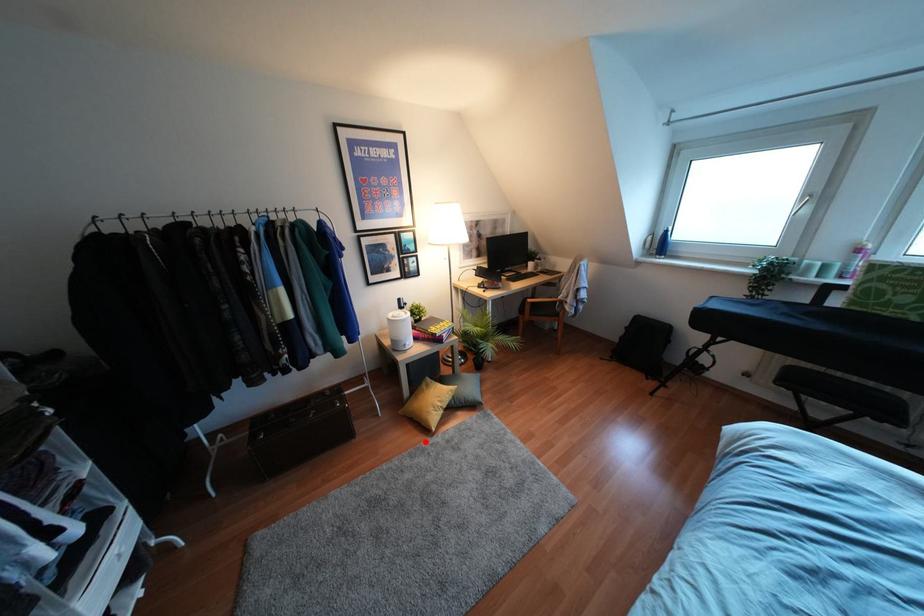
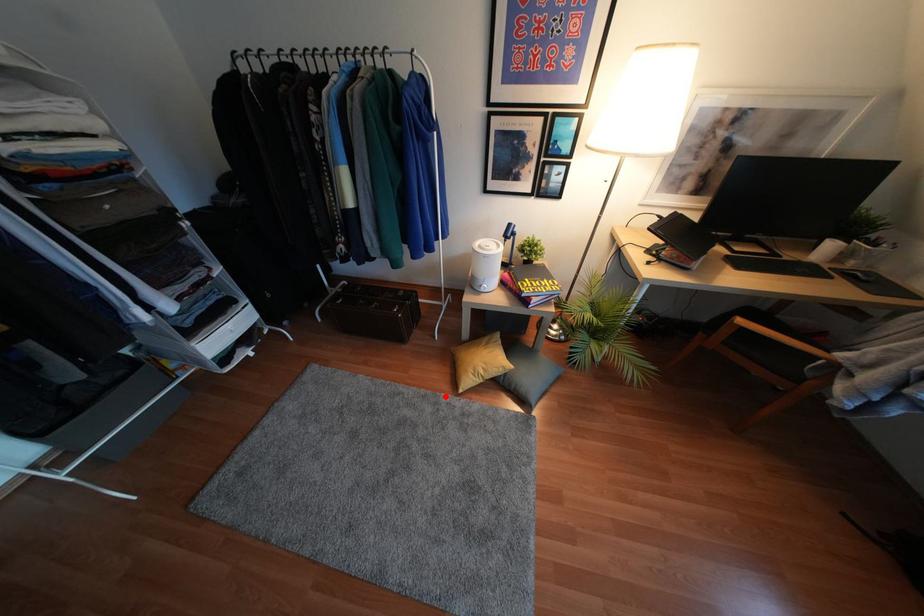
I am providing you with two images of the same scene from different viewpoints. A red point is marked on the first image and another point is marked on the second image. Does the point marked in image1 correspond to the same location as the one in image2?

Yes